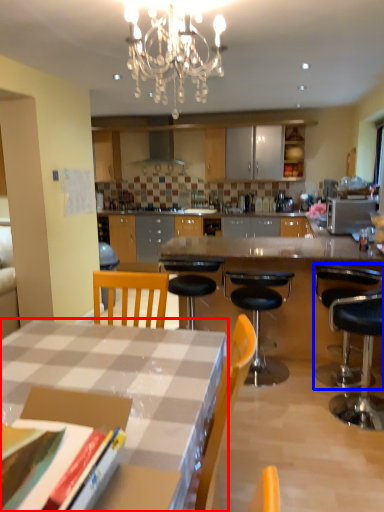
Question: Which object is further to the camera taking this photo, desk (highlighted by a red box) or chair (highlighted by a blue box)?

Choices:
 (A) desk
 (B) chair

Answer: (B)